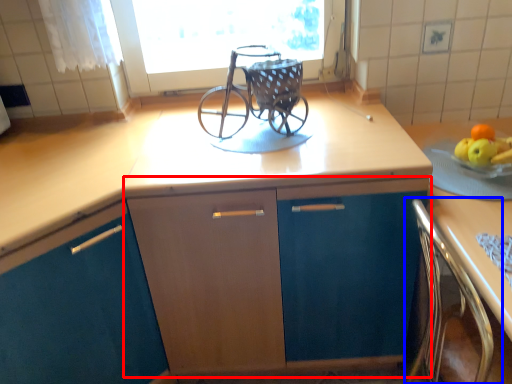
Question: Which of the following is the closest to the observer, cabinetry (highlighted by a red box) or chair (highlighted by a blue box)?

Choices:
 (A) cabinetry
 (B) chair

Answer: (B)